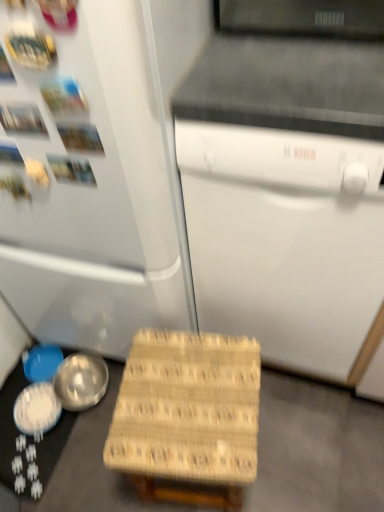
Question: Considering the positions of shiny silver bowl at lower left, the 2th bowl from the left, and white matte dishwasher at center in the image, is shiny silver bowl at lower left, the 2th bowl from the left, bigger or smaller than white matte dishwasher at center?

Choices:
 (A) small
 (B) big

Answer: (A)

Question: In the image, is shiny silver bowl at lower left, positioned as the 2th bowl in right-to-left order, on the left side or the right side of white matte dishwasher at center?

Choices:
 (A) right
 (B) left

Answer: (B)

Question: Estimate the real-world distances between objects in this image. Which object is closer to the shiny silver bowl at lower left, positioned as the 2th bowl in right-to-left order?

Choices:
 (A) shiny metallic bowl at lower left, the third bowl when ordered from left to right
 (B) white matte refrigerator at left
 (C) blue matte bowl at lower left, acting as the 3th bowl starting from the right
 (D) white matte dishwasher at center
 (E) woven wood step stool at lower center

Answer: (A)

Question: Which is farther from the shiny silver bowl at lower left, positioned as the 2th bowl in right-to-left order?

Choices:
 (A) white matte refrigerator at left
 (B) white matte dishwasher at center
 (C) blue matte bowl at lower left, acting as the 1th bowl starting from the left
 (D) shiny metallic bowl at lower left, which is the 1th bowl from right to left
 (E) woven wood step stool at lower center

Answer: (B)